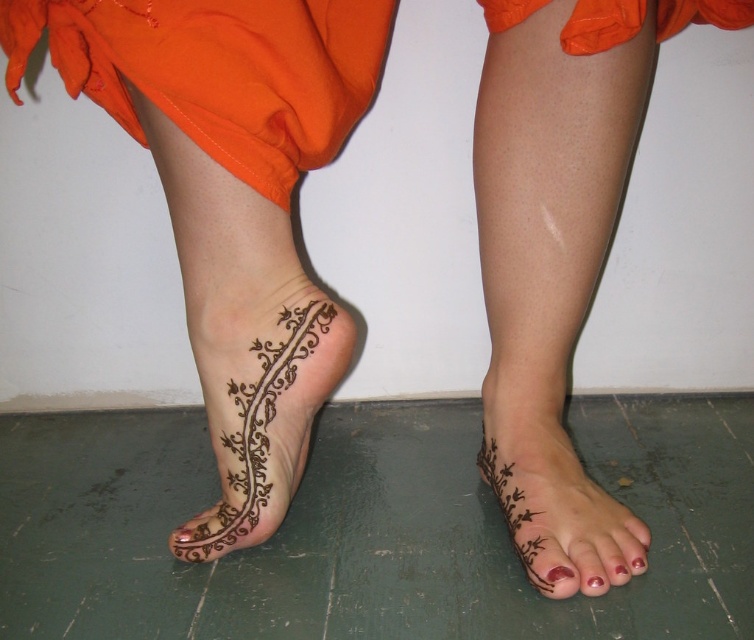
You are a photographer taking a closeup shot of the lower legs and feet. You want to focus on both the brown henna tattoo at lower left and the glossy red nail polish at lower center. Given that your camera has a depth of field that can sharply capture objects within a 16 inch range, will both subjects be in focus?

The brown henna tattoo at lower left and glossy red nail polish at lower center are 16.57 inches apart from each other. Since the camera can only sharply capture within a 16 inch range, the distance between them exceeds this limit. Therefore, both subjects cannot be in focus simultaneously.

In the scene shown: You are a makeup artist preparing for a photoshoot. You have to decide whether the brown henna tattoo at lower left will fit within the frame if you place it next to the glossy red nail polish at lower center. Which object is wider?

The brown henna tattoo at lower left is wider than the glossy red nail polish at lower center, so it will not fit within the same frame if placed next to it without overlapping.

You are a photographer taking a close up of a person wearing an orange garment. You need to focus on the brown henna tattoo at lower center. Where exactly should you point your camera?

The brown henna tattoo at lower center is located at point (556, 504), so you should point your camera there to focus on it.